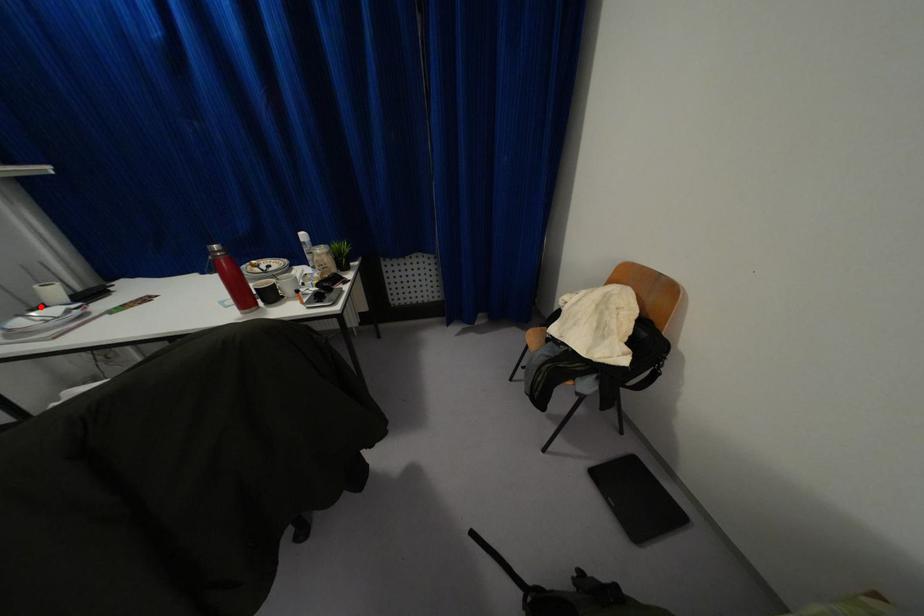
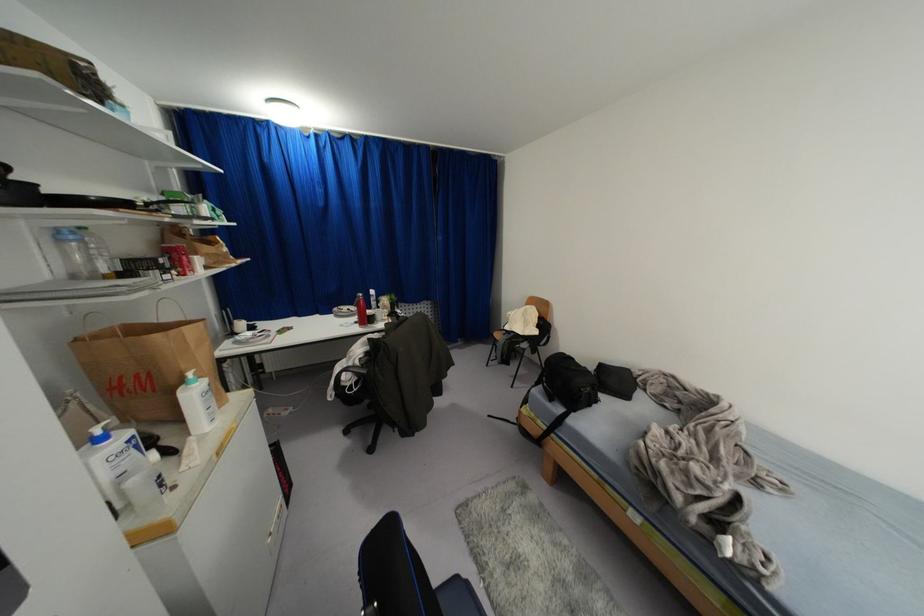
In the second image, find the point that corresponds to the highlighted location in the first image.

(234, 333)